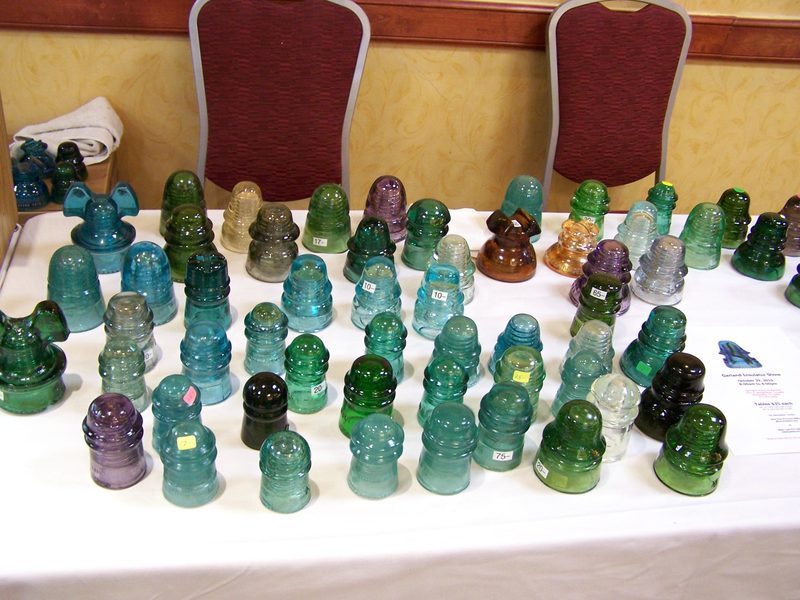
This screenshot has width=800, height=600. I want to click on chair, so click(x=632, y=90).